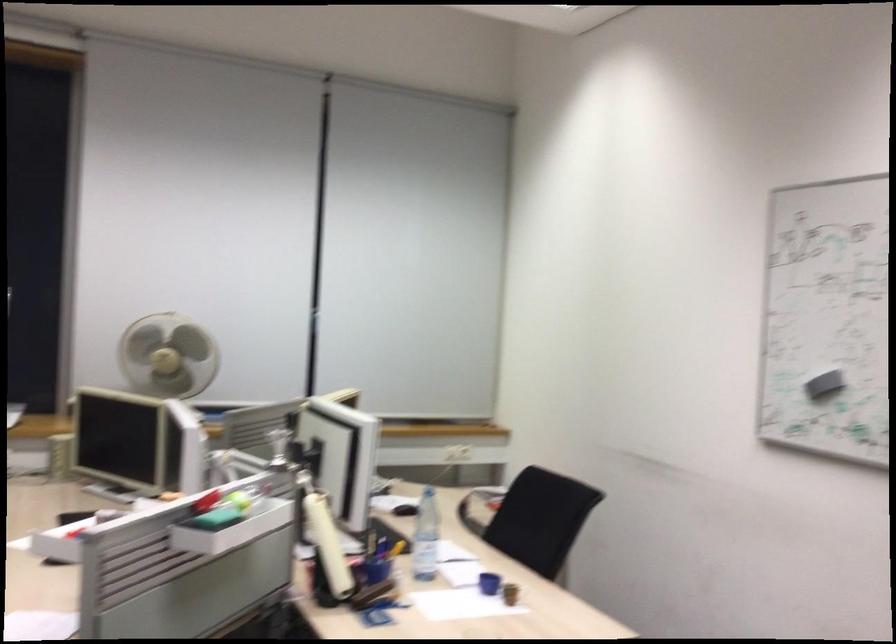
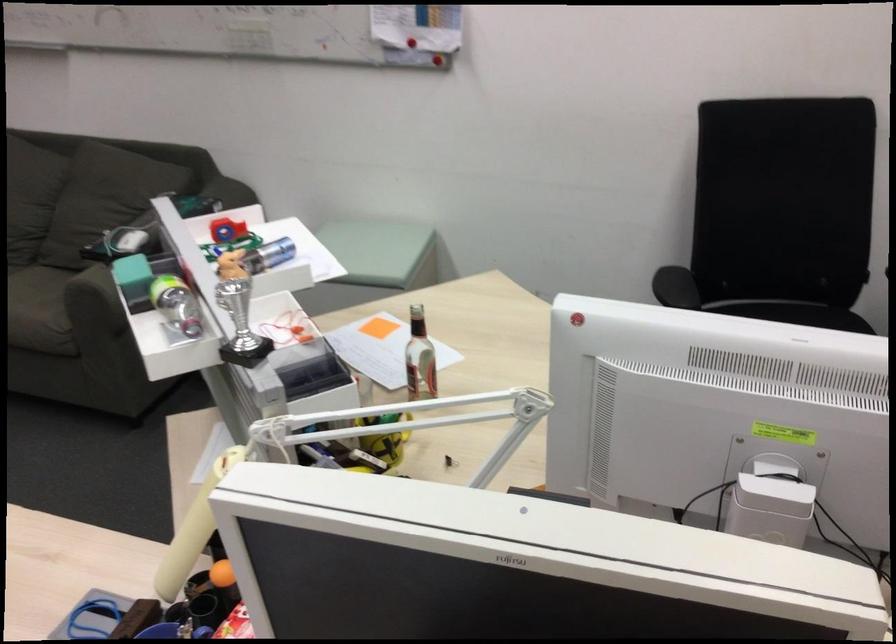
The point at (196, 464) is marked in the first image. Where is the corresponding point in the second image?

(770, 509)